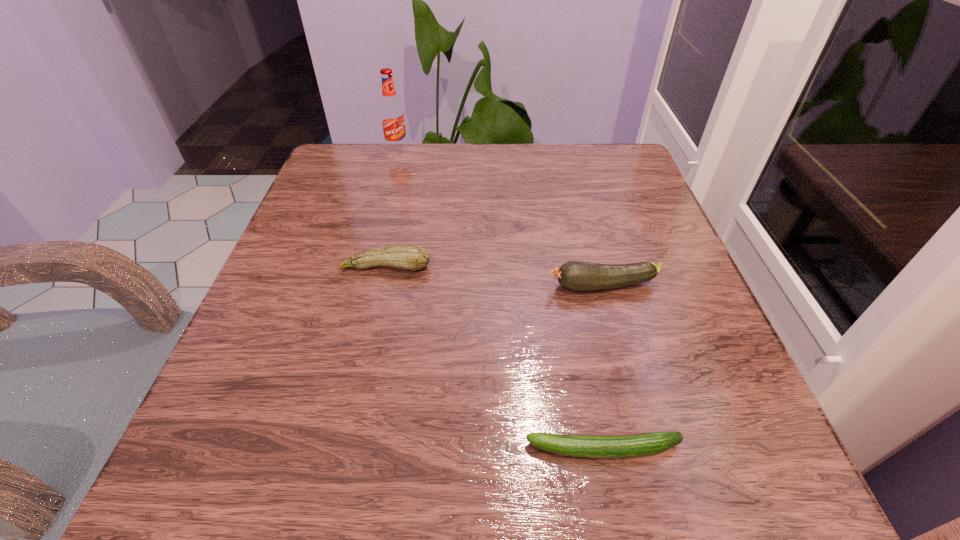
The height and width of the screenshot is (540, 960). Find the location of `zucchini that stands as the closest to the nearest zucchini`. zucchini that stands as the closest to the nearest zucchini is located at coordinates (574, 275).